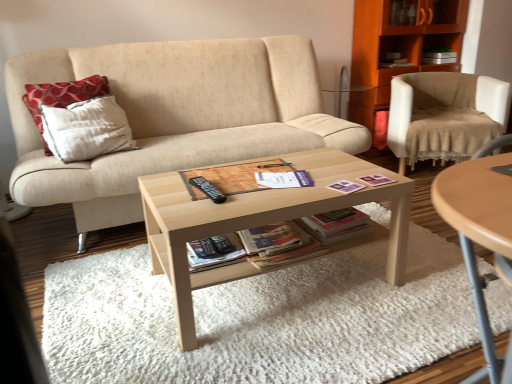
Find the location of a particular element. The width and height of the screenshot is (512, 384). vacant area that lies in front of white paper at center is located at coordinates 282,201.